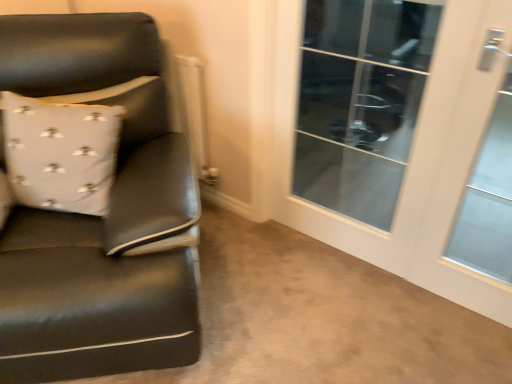
Question: Can you confirm if white textured pillow at left is taller than transparent glass door at right, arranged as the 1th screen door when viewed from the left?

Choices:
 (A) yes
 (B) no

Answer: (B)

Question: From a real-world perspective, is white textured pillow at left on transparent glass door at right, which is counted as the second screen door, starting from the right?

Choices:
 (A) no
 (B) yes

Answer: (B)

Question: Does white textured pillow at left have a lesser height compared to transparent glass door at right, arranged as the 1th screen door when viewed from the left?

Choices:
 (A) yes
 (B) no

Answer: (A)

Question: Could you tell me if white textured pillow at left is turned towards transparent glass door at right, arranged as the 1th screen door when viewed from the left?

Choices:
 (A) yes
 (B) no

Answer: (B)

Question: Considering the relative sizes of white textured pillow at left and transparent glass door at right, which is counted as the second screen door, starting from the right, in the image provided, is white textured pillow at left bigger than transparent glass door at right, which is counted as the second screen door, starting from the right,?

Choices:
 (A) yes
 (B) no

Answer: (B)

Question: Does white textured pillow at left appear on the left side of transparent glass door at right, arranged as the 1th screen door when viewed from the left?

Choices:
 (A) no
 (B) yes

Answer: (B)

Question: Is white glossy door at right, arranged as the second screen door when viewed from the left, shorter than transparent glass door at right, which is counted as the second screen door, starting from the right?

Choices:
 (A) yes
 (B) no

Answer: (A)

Question: Is white glossy door at right, arranged as the second screen door when viewed from the left, aimed at transparent glass door at right, arranged as the 1th screen door when viewed from the left?

Choices:
 (A) no
 (B) yes

Answer: (B)

Question: Can you confirm if white glossy door at right, which is counted as the first screen door, starting from the right, is thinner than transparent glass door at right, arranged as the 1th screen door when viewed from the left?

Choices:
 (A) no
 (B) yes

Answer: (B)

Question: Considering the relative positions of white glossy door at right, arranged as the second screen door when viewed from the left, and transparent glass door at right, arranged as the 1th screen door when viewed from the left, in the image provided, is white glossy door at right, arranged as the second screen door when viewed from the left, to the right of transparent glass door at right, arranged as the 1th screen door when viewed from the left, from the viewer's perspective?

Choices:
 (A) no
 (B) yes

Answer: (B)

Question: Is white glossy door at right, which is counted as the first screen door, starting from the right, placed right next to transparent glass door at right, which is counted as the second screen door, starting from the right?

Choices:
 (A) no
 (B) yes

Answer: (A)

Question: Is white glossy door at right, arranged as the second screen door when viewed from the left, wider than transparent glass door at right, arranged as the 1th screen door when viewed from the left?

Choices:
 (A) yes
 (B) no

Answer: (B)

Question: Does white textured pillow at left come behind transparent glass door at upper right?

Choices:
 (A) yes
 (B) no

Answer: (B)